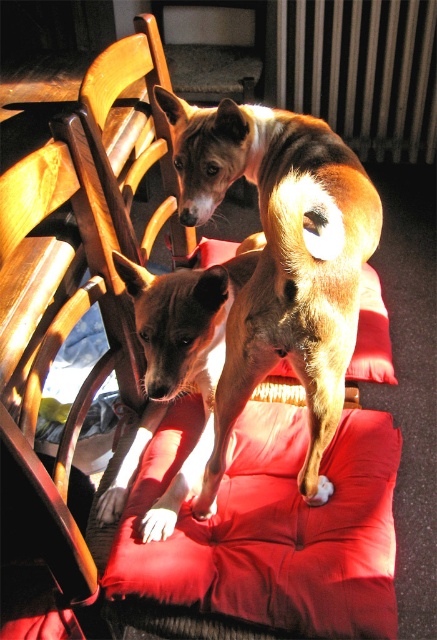
Question: Is brown furry dog at center bigger than velvet red cushion at center?

Choices:
 (A) yes
 (B) no

Answer: (A)

Question: Does brown furry dog at center appear under velvet red cushion at center?

Choices:
 (A) yes
 (B) no

Answer: (B)

Question: Does brown furry dog at center appear under velvet red cushion at center?

Choices:
 (A) no
 (B) yes

Answer: (A)

Question: Which point is closer to the camera taking this photo?

Choices:
 (A) (356, 340)
 (B) (315, 173)

Answer: (B)

Question: Which of the following is the closest to the observer?

Choices:
 (A) velvet red cushion at center
 (B) brown furry dog at center

Answer: (B)